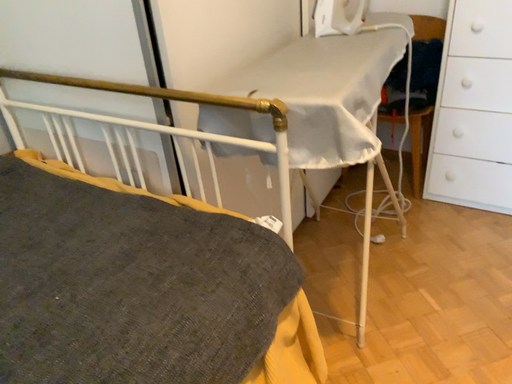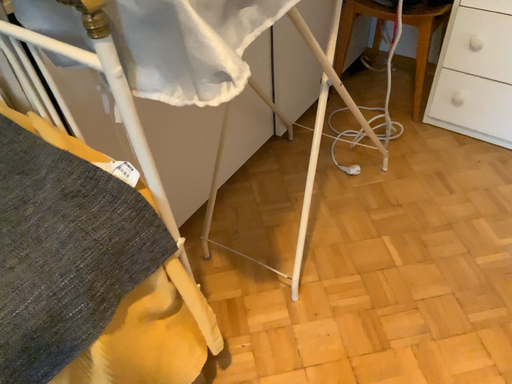
Question: Which way did the camera rotate in the video?

Choices:
 (A) rotated upward
 (B) rotated downward

Answer: (B)